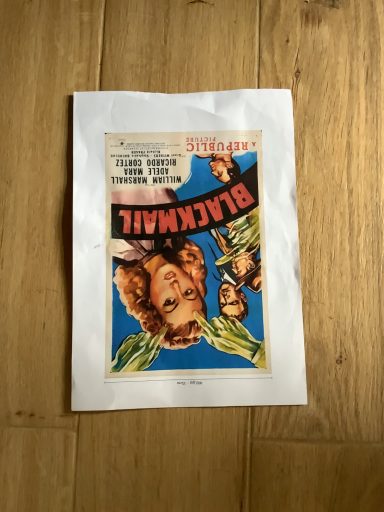
You are a GUI agent. You are given a task and a screenshot of the screen. Output one action in this format:
    pyautogui.click(x=<x>, y=<y>)
    Task: Click on the empty space that is ontop of vibrant paper poster at center (from a real-world perspective)
    The height and width of the screenshot is (512, 384).
    Given the screenshot: What is the action you would take?
    pyautogui.click(x=183, y=244)